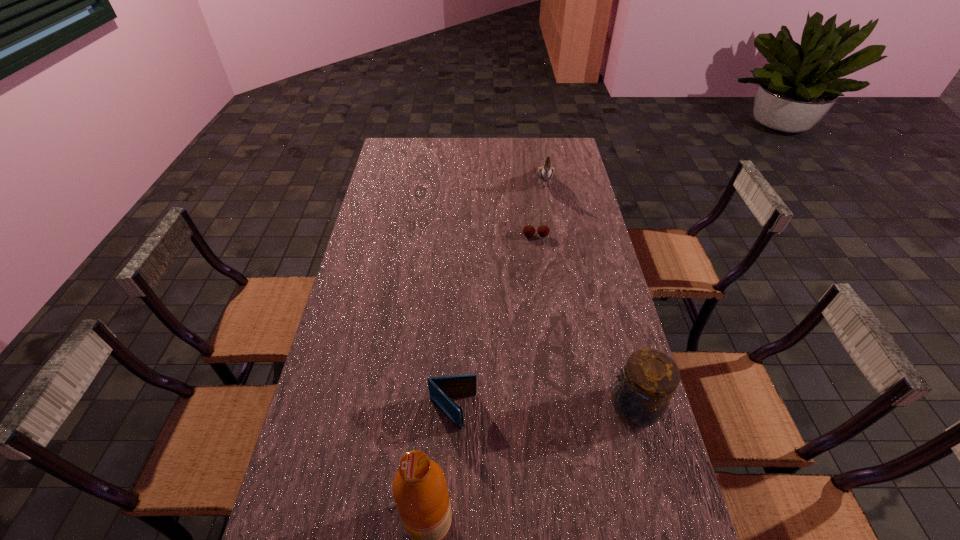
This screenshot has width=960, height=540. What are the coordinates of `vacant space on the desktop that is between the tallest object and the rightmost object and is positioned on the surface of the cherry` in the screenshot? It's located at (542, 457).

Locate an element on the screen. The image size is (960, 540). vacant spot on the desktop that is between the fruit juice and the rightmost object and is positioned at the face of the bird is located at coordinates (529, 465).

At what (x,y) coordinates should I click in order to perform the action: click on vacant space on the desktop that is between the tallest object and the rightmost object and is positioned on the exterior surface of the shortest object. Please return your answer as a coordinate pair (x, y). This screenshot has width=960, height=540. Looking at the image, I should click on (514, 474).